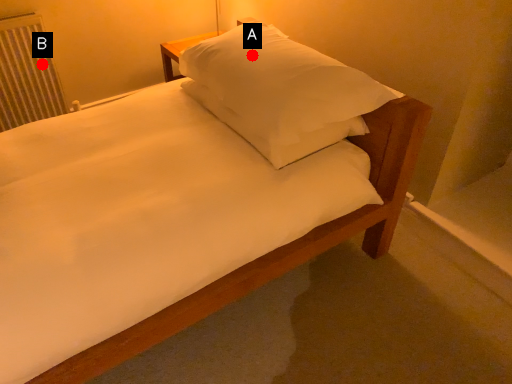
Question: Two points are circled on the image, labeled by A and B beside each circle. Which point is further to the camera?

Choices:
 (A) A is further
 (B) B is further

Answer: (B)